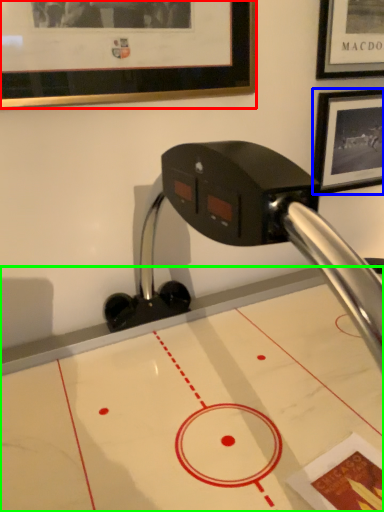
Question: Which object is positioned closest to picture frame (highlighted by a red box)? Select from picture frame (highlighted by a blue box) and table (highlighted by a green box).

Choices:
 (A) picture frame
 (B) table

Answer: (A)